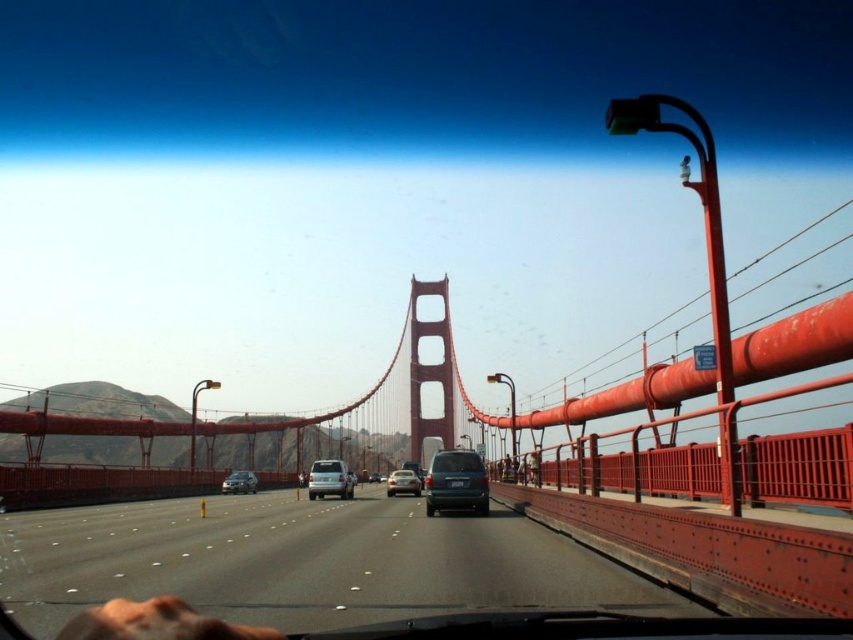
What do you see at coordinates (305, 563) in the screenshot? I see `smooth asphalt highway at center` at bounding box center [305, 563].

The height and width of the screenshot is (640, 853). I want to click on smooth asphalt highway at center, so click(x=305, y=563).

Does point (379, 502) come in front of point (390, 490)?

Yes, point (379, 502) is in front of point (390, 490).

Locate an element on the screen. The height and width of the screenshot is (640, 853). smooth asphalt highway at center is located at coordinates (305, 563).

Between satin silver sedan at center and silver metallic sedan at center, which one is positioned higher?

silver metallic sedan at center

What do you see at coordinates (403, 483) in the screenshot? I see `satin silver sedan at center` at bounding box center [403, 483].

Identify the location of satin silver sedan at center. The height and width of the screenshot is (640, 853). (403, 483).

Can you confirm if satin silver van at center is positioned to the left of satin silver sedan at center?

Correct, you'll find satin silver van at center to the left of satin silver sedan at center.

Who is lower down, satin silver van at center or satin silver sedan at center?

satin silver sedan at center

Between point (314, 483) and point (398, 474), which one is positioned behind?

The point (398, 474) is behind.

I want to click on satin silver van at center, so click(329, 480).